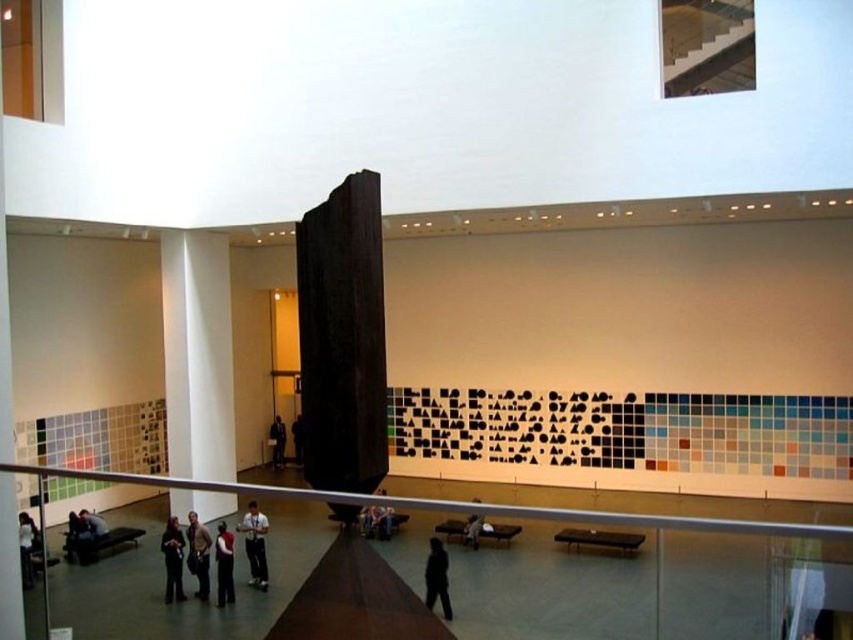
Question: Which of the following is the farthest from the observer?

Choices:
 (A) (251, 524)
 (B) (293, 426)
 (C) (97, 515)
 (D) (277, 465)

Answer: (B)

Question: Which object is farther from the camera taking this photo?

Choices:
 (A) dark brown wooden statue at center
 (B) dark brown leather jacket at lower center
 (C) dark matte figure at center

Answer: (A)

Question: Can you confirm if white smooth pillar at center is positioned to the right of dark brown leather jacket at center?

Choices:
 (A) yes
 (B) no

Answer: (B)

Question: Which object is farther from the camera taking this photo?

Choices:
 (A) white shirt at center
 (B) dark matte figure at center

Answer: (A)

Question: Can you confirm if dark gray pants at lower left is bigger than dark gray suit at lower left?

Choices:
 (A) yes
 (B) no

Answer: (A)

Question: Can you confirm if dark gray pants at lower left is thinner than dark matte figure at center?

Choices:
 (A) yes
 (B) no

Answer: (B)